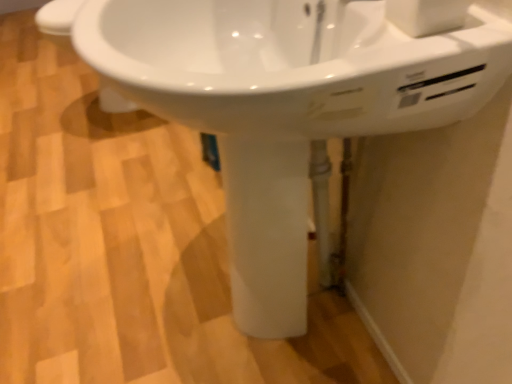
Image resolution: width=512 pixels, height=384 pixels. I want to click on vacant space underneath white glossy toilet bowl at lower left (from a real-world perspective), so click(x=95, y=106).